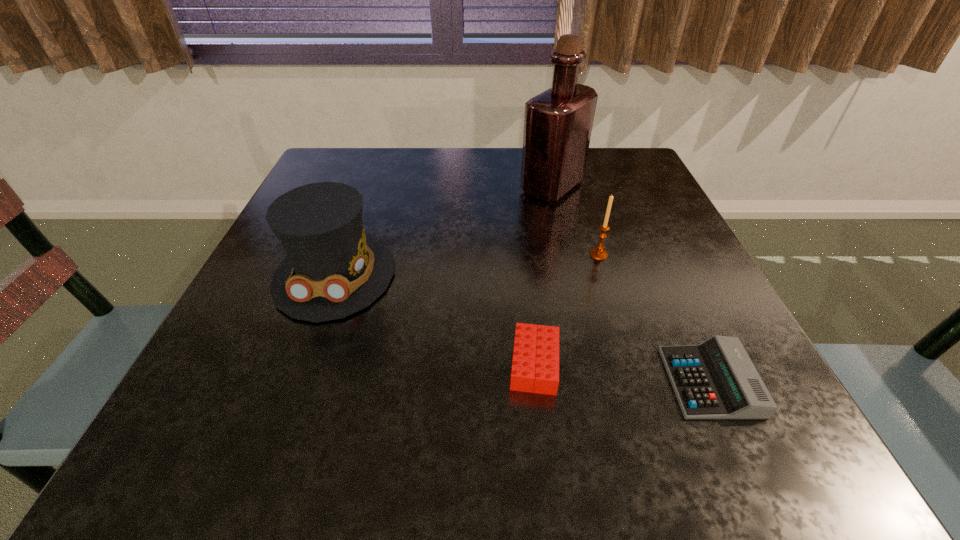
Find the location of `free space that is in between the Lego and the shortest object`. free space that is in between the Lego and the shortest object is located at coordinates (622, 373).

In order to click on free space that is in between the dress hat and the candle_holder in this screenshot , I will do `click(467, 265)`.

Identify the location of vacant space that's between the farthest object and the second shortest object. (543, 275).

Find the location of a particular element. This screenshot has height=540, width=960. the second closest object to the dress hat is located at coordinates (558, 123).

This screenshot has height=540, width=960. I want to click on object that ranks as the second closest to the leftmost object, so click(x=558, y=123).

Locate an element on the screen. free space in the image that satisfies the following two spatial constraints: 1. on the front side of the Lego; 2. on the left side of the rightmost object is located at coordinates (537, 382).

Locate an element on the screen. free space that satisfies the following two spatial constraints: 1. with goggles on the front of the leftmost object; 2. on the right side of the second shortest object is located at coordinates 301,364.

You are a GUI agent. You are given a task and a screenshot of the screen. Output one action in this format:
    pyautogui.click(x=<x>, y=<y>)
    Task: Click on the free space that satisfies the following two spatial constraints: 1. on the front side of the calculator; 2. on the right side of the candle_holder
    
    Given the screenshot: What is the action you would take?
    pyautogui.click(x=638, y=382)